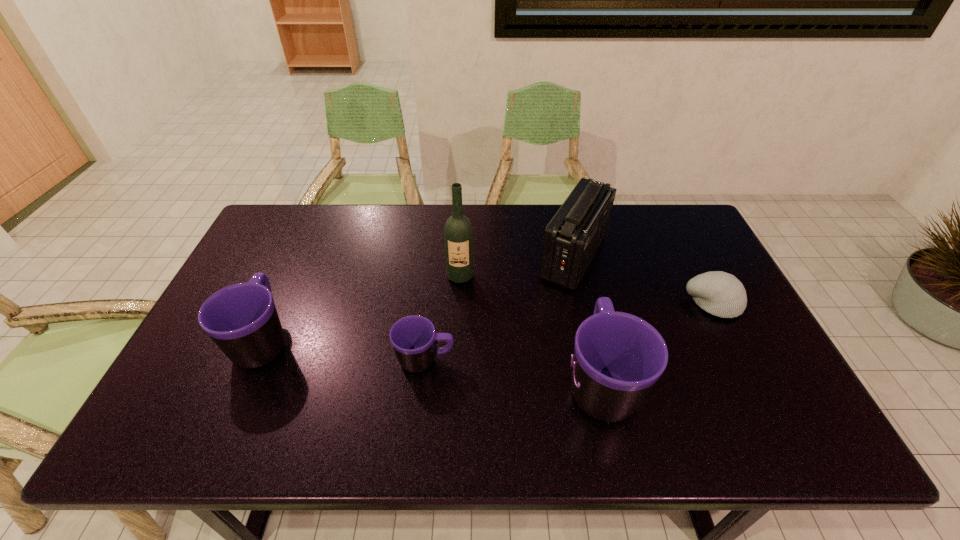
Locate an element on the screen. The image size is (960, 540). free space located 0.390m with the handle on the side of the shortest mug is located at coordinates (610, 361).

In order to click on vacant region located 0.340m with the handle on the side of the rightmost mug in this screenshot , I will do `click(571, 254)`.

In order to click on vacant space situated 0.260m with the handle on the side of the rightmost mug in this screenshot , I will do `click(575, 272)`.

Locate an element on the screen. free space located 0.060m with the handle on the side of the rightmost mug is located at coordinates (587, 322).

This screenshot has height=540, width=960. I want to click on vacant space located 0.230m on the front panel of the radio receiver, so click(463, 257).

The height and width of the screenshot is (540, 960). I want to click on free location located 0.390m on the front panel of the radio receiver, so click(412, 257).

Locate an element on the screen. The width and height of the screenshot is (960, 540). vacant point located 0.120m on the front panel of the radio receiver is located at coordinates (497, 257).

Find the location of a particular element. vacant area located on the labeled side of the wine bottle is located at coordinates (457, 358).

You are a GUI agent. You are given a task and a screenshot of the screen. Output one action in this format:
    pyautogui.click(x=<x>, y=<y>)
    Task: Click on the vacant space located on the back of the beanie
    
    Given the screenshot: What is the action you would take?
    pyautogui.click(x=681, y=242)

At what (x,y) coordinates should I click in order to perform the action: click on object at the far edge. Please return your answer as a coordinate pair (x, y). The width and height of the screenshot is (960, 540). Looking at the image, I should click on (572, 237).